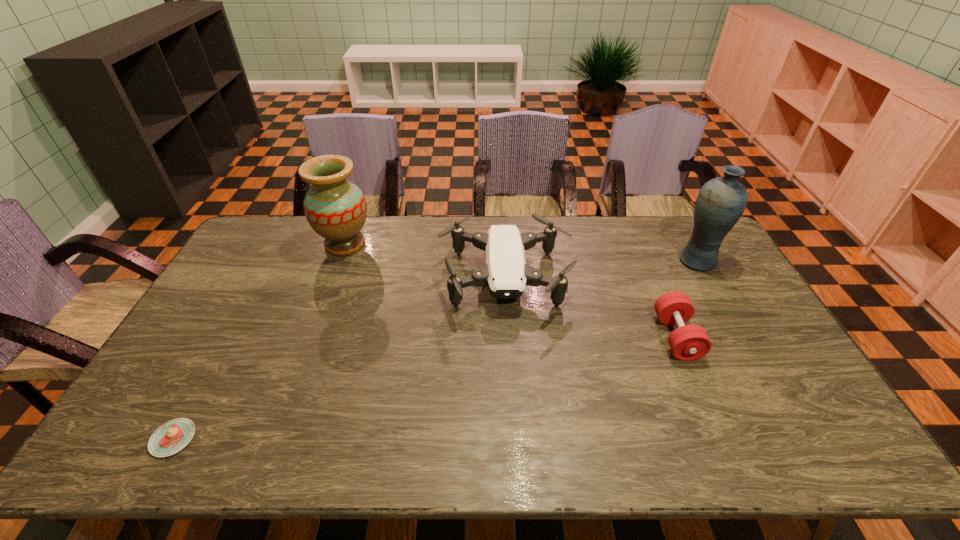
Identify the location of vacant region located 0.310m on the camera side of the drone. (514, 421).

Identify the location of vacant space located 0.210m on the back of the fourth object from left to right. The image size is (960, 540). (647, 268).

Image resolution: width=960 pixels, height=540 pixels. What are the coordinates of `free space located on the back of the leftmost object` in the screenshot? It's located at (245, 308).

This screenshot has height=540, width=960. Find the location of `drone that is at the far edge`. drone that is at the far edge is located at coordinates (506, 272).

Image resolution: width=960 pixels, height=540 pixels. I want to click on object at the near edge, so click(x=171, y=437).

Image resolution: width=960 pixels, height=540 pixels. I want to click on object that is at the left edge, so click(x=171, y=437).

Locate an element on the screen. object at the right edge is located at coordinates click(x=720, y=203).

You are a GUI agent. You are given a task and a screenshot of the screen. Output one action in this format:
    pyautogui.click(x=<x>, y=<y>)
    Task: Click on the object positioned at the near left corner
    Image resolution: width=960 pixels, height=540 pixels.
    Given the screenshot: What is the action you would take?
    pyautogui.click(x=171, y=437)

The height and width of the screenshot is (540, 960). In order to click on object located at the far right corner in this screenshot , I will do `click(720, 203)`.

Find the location of a particular element. This screenshot has height=540, width=960. vacant space at the far edge of the desktop is located at coordinates (387, 232).